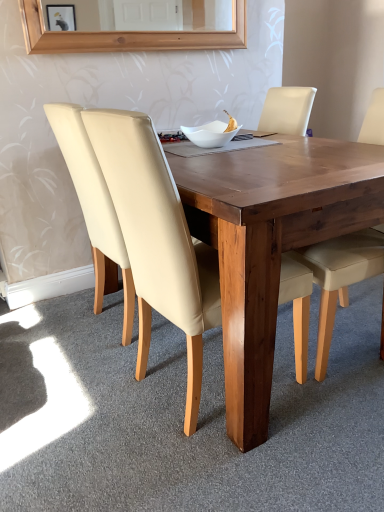
Question: Should I look upward or downward to see beige leather chair at left, placed as the third chair when sorted from right to left?

Choices:
 (A) up
 (B) down

Answer: (A)

Question: From a real-world perspective, is wooden table at center beneath beige leather chair at center, which is the third chair from left to right?

Choices:
 (A) no
 (B) yes

Answer: (B)

Question: Is wooden table at center wider than beige leather chair at center, which is the third chair from left to right?

Choices:
 (A) yes
 (B) no

Answer: (A)

Question: Considering the relative sizes of wooden table at center and beige leather chair at center, which appears as the first chair when viewed from the right, in the image provided, is wooden table at center smaller than beige leather chair at center, which appears as the first chair when viewed from the right,?

Choices:
 (A) yes
 (B) no

Answer: (B)

Question: From the image's perspective, does wooden table at center appear higher than beige leather chair at center, which appears as the first chair when viewed from the right?

Choices:
 (A) yes
 (B) no

Answer: (B)

Question: Is wooden table at center positioned before beige leather chair at center, which is the third chair from left to right?

Choices:
 (A) yes
 (B) no

Answer: (A)

Question: Could beige leather chair at center, which appears as the first chair when viewed from the right, be considered to be inside wooden table at center?

Choices:
 (A) yes
 (B) no

Answer: (A)

Question: From a real-world perspective, is beige leather chair at center, which appears as the first chair when viewed from the right, positioned under white glossy bowl at center based on gravity?

Choices:
 (A) yes
 (B) no

Answer: (A)

Question: Considering the relative sizes of beige leather chair at center, which appears as the first chair when viewed from the right, and white glossy bowl at center in the image provided, is beige leather chair at center, which appears as the first chair when viewed from the right, bigger than white glossy bowl at center?

Choices:
 (A) no
 (B) yes

Answer: (B)

Question: Could you tell me if beige leather chair at center, which is the third chair from left to right, is turned towards white glossy bowl at center?

Choices:
 (A) no
 (B) yes

Answer: (A)

Question: Can you confirm if beige leather chair at center, which appears as the first chair when viewed from the right, is wider than white glossy bowl at center?

Choices:
 (A) no
 (B) yes

Answer: (B)

Question: Considering the relative positions of beige leather chair at center, which is the third chair from left to right, and white glossy bowl at center in the image provided, is beige leather chair at center, which is the third chair from left to right, to the right of white glossy bowl at center from the viewer's perspective?

Choices:
 (A) no
 (B) yes

Answer: (B)

Question: Can you confirm if beige leather chair at center, which is the third chair from left to right, is smaller than white glossy bowl at center?

Choices:
 (A) no
 (B) yes

Answer: (A)

Question: Can you confirm if white glossy bowl at center is taller than beige leather chair at left, which appears as the second chair when viewed from the left?

Choices:
 (A) no
 (B) yes

Answer: (A)